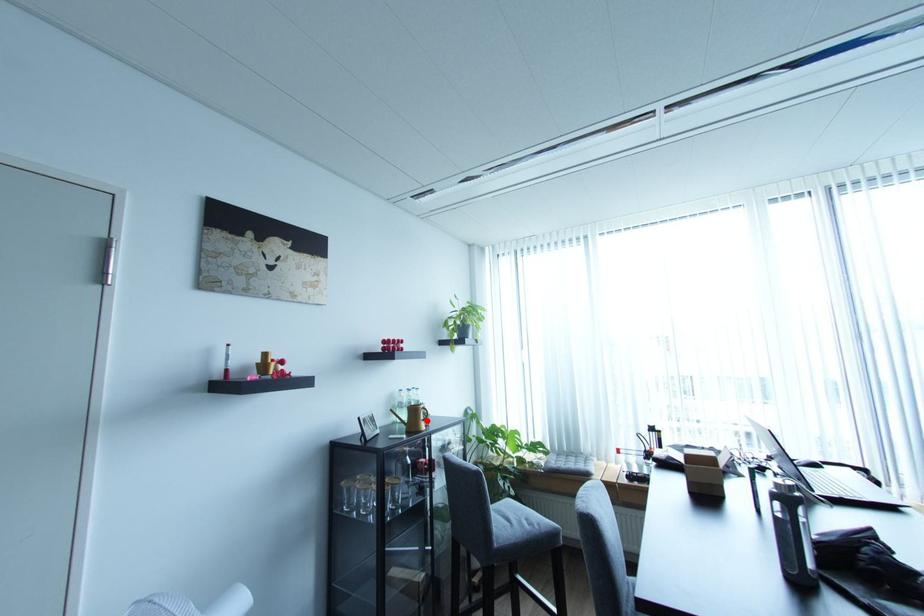
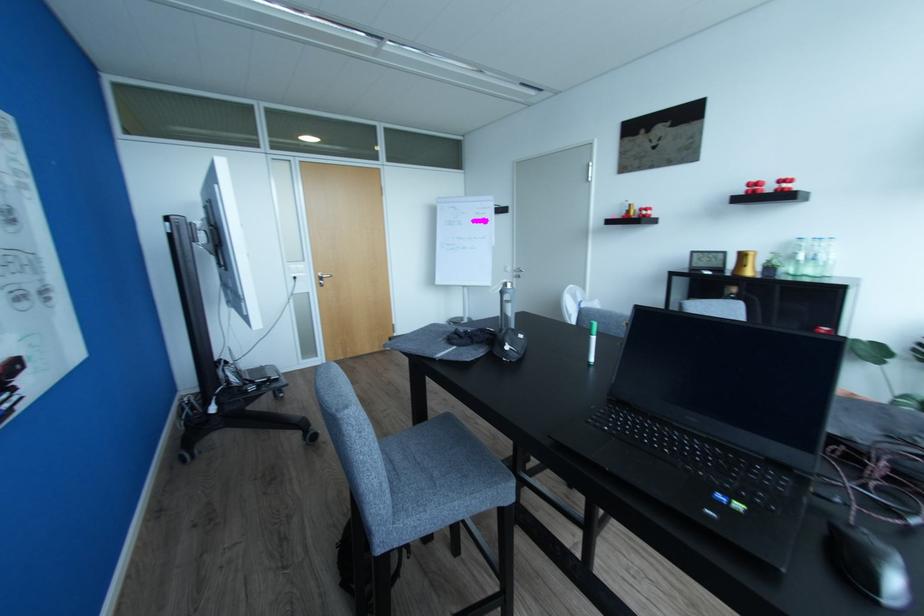
Find the pixel in the second image that matches the highlighted location in the first image.

(750, 267)